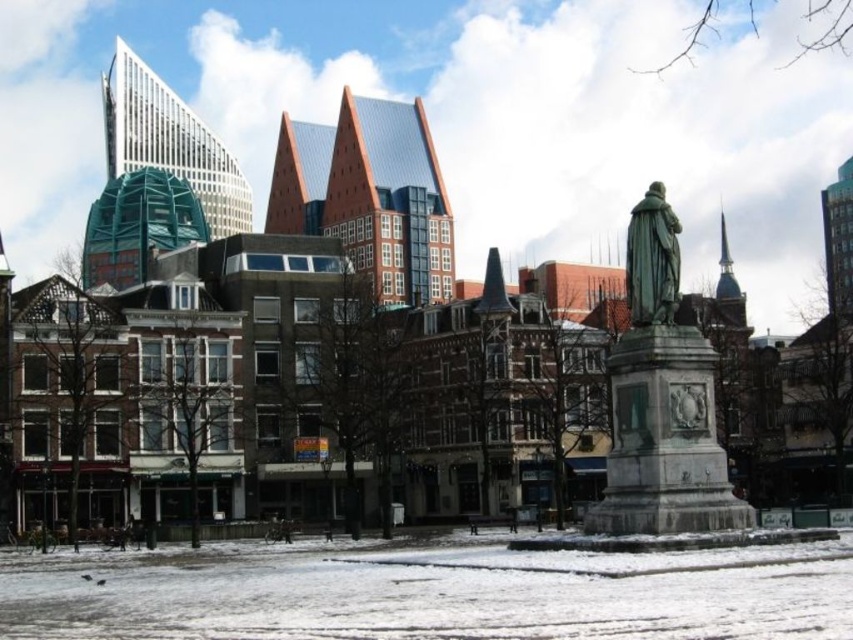
You are an architect designing a new pathway that needs to pass between the bronze statue at center and the green polished stone statue at center. The pathway must be at least 2 meters wide to accommodate visitors. Given their widths, can the pathway fit between them?

The bronze statue at center has a lesser width compared to the green polished stone statue at center. However, without specific measurements of their widths, it is impossible to determine if the 2 meter pathway can fit between them.